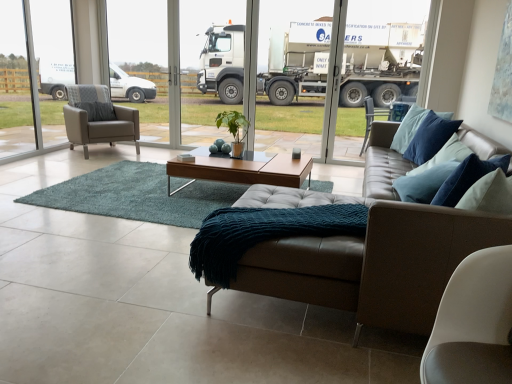
Question: Can you confirm if teal knitted blanket at center is taller than matte gray armchair at left?

Choices:
 (A) yes
 (B) no

Answer: (B)

Question: Is teal knitted blanket at center bigger than matte gray armchair at left?

Choices:
 (A) no
 (B) yes

Answer: (A)

Question: From a real-world perspective, is teal knitted blanket at center under matte gray armchair at left?

Choices:
 (A) yes
 (B) no

Answer: (A)

Question: Considering the relative sizes of teal knitted blanket at center and matte gray armchair at left in the image provided, is teal knitted blanket at center smaller than matte gray armchair at left?

Choices:
 (A) no
 (B) yes

Answer: (B)

Question: From the image's perspective, would you say teal knitted blanket at center is positioned over matte gray armchair at left?

Choices:
 (A) no
 (B) yes

Answer: (A)

Question: Relative to white glossy truck at upper center, is matte gray armchair at left in front or behind?

Choices:
 (A) front
 (B) behind

Answer: (A)

Question: Is matte gray armchair at left taller or shorter than white glossy truck at upper center?

Choices:
 (A) tall
 (B) short

Answer: (B)

Question: From the image's perspective, is matte gray armchair at left located above or below white glossy truck at upper center?

Choices:
 (A) above
 (B) below

Answer: (B)

Question: Considering the relative positions of matte gray armchair at left and white glossy truck at upper center in the image provided, is matte gray armchair at left to the left or to the right of white glossy truck at upper center?

Choices:
 (A) left
 (B) right

Answer: (A)

Question: Choose the correct answer: Is light brown wood coffee table at center inside matte gray armchair at left or outside it?

Choices:
 (A) inside
 (B) outside

Answer: (B)

Question: From the image's perspective, relative to matte gray armchair at left, is light brown wood coffee table at center above or below?

Choices:
 (A) above
 (B) below

Answer: (B)

Question: From a real-world perspective, is light brown wood coffee table at center physically located above or below matte gray armchair at left?

Choices:
 (A) below
 (B) above

Answer: (A)

Question: Is point (266, 165) closer or farther from the camera than point (111, 142)?

Choices:
 (A) farther
 (B) closer

Answer: (B)

Question: Is matte gray armchair at left inside or outside of white glossy truck at upper center?

Choices:
 (A) outside
 (B) inside

Answer: (A)

Question: From a real-world perspective, is matte gray armchair at left physically located above or below white glossy truck at upper center?

Choices:
 (A) above
 (B) below

Answer: (B)